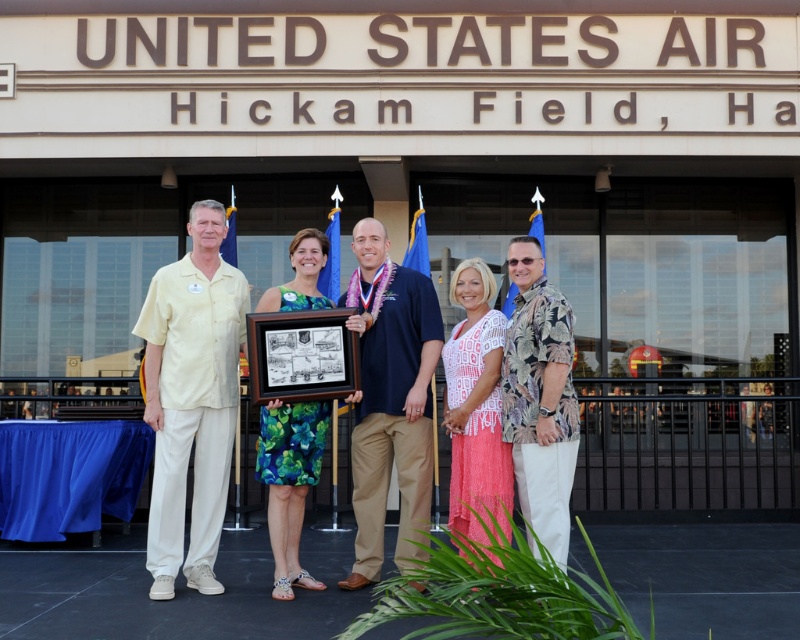
You are standing in front of the building at Hickam Field and want to move from point A at point (168, 317) to point B at point (534, 525). Considering the spatial relationship between these two points, which direction should you face to move towards point B from point A?

Point A at point (168, 317) is closer to the viewer than point B at point (534, 525). To move from point A to point B, you should face away from the building towards the background of the image.

You are a photographer trying to capture a clear photo of the dark blue shirt at center and the hawaiian print shirt at center. Which one is blocking the view of the other?

The hawaiian print shirt at center is behind the dark blue shirt at center, so the dark blue shirt at center is blocking the view of the hawaiian print shirt at center.

You are a photographer taking a group photo of the people in the scene. You notice the yellow cotton shirt at left and the hawaiian print shirt at center. Which one is positioned higher in the frame?

The yellow cotton shirt at left is positioned higher in the frame than the hawaiian print shirt at center because it is located above it according to the description.